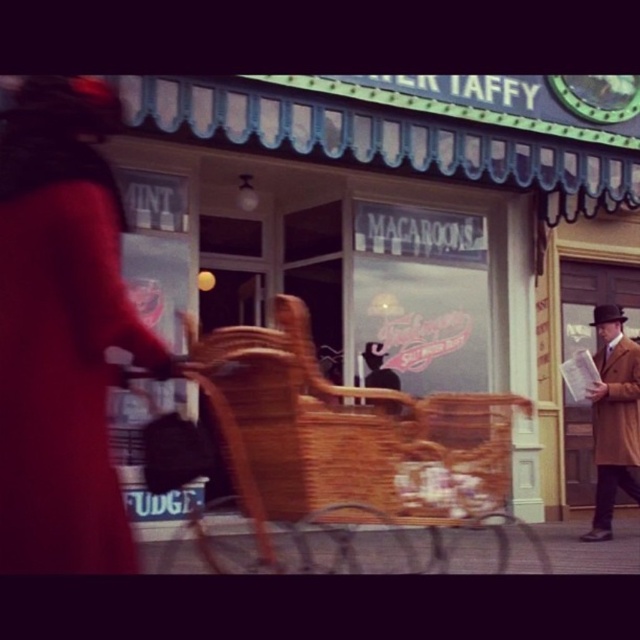
You are a photographer trying to capture both the velvet red coat at upper left and the woven wood baby carriage at center in a single shot. Given their height difference, which object will require you to adjust your camera angle upwards more to include it in the frame?

The velvet red coat at upper left has a greater height compared to the woven wood baby carriage at center, so you will need to adjust your camera angle upwards more to include the velvet red coat at upper left in the frame.

In the scene shown: You are a delivery person who needs to load a package into the woven wood baby carriage at center. The package is as tall as the tan wool coat at right. Will the package fit vertically in the carriage?

The woven wood baby carriage at center is taller than the tan wool coat at right. Since the package is as tall as the tan wool coat at right, it will fit vertically in the carriage.